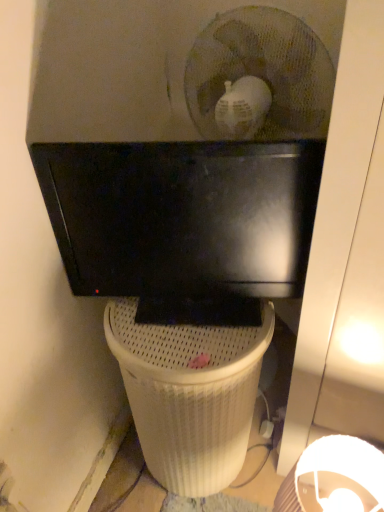
Question: Considering the positions of white mesh waste container at center and matte black monitor at upper center in the image, is white mesh waste container at center wider or thinner than matte black monitor at upper center?

Choices:
 (A) wide
 (B) thin

Answer: (A)

Question: From the image's perspective, is white mesh waste container at center located above or below matte black monitor at upper center?

Choices:
 (A) below
 (B) above

Answer: (A)

Question: In the image, is white mesh waste container at center positioned in front of or behind matte black monitor at upper center?

Choices:
 (A) behind
 (B) front

Answer: (A)

Question: Considering the positions of matte black monitor at upper center and white mesh waste container at center in the image, is matte black monitor at upper center taller or shorter than white mesh waste container at center?

Choices:
 (A) tall
 (B) short

Answer: (B)

Question: Looking at their shapes, would you say matte black monitor at upper center is wider or thinner than white mesh waste container at center?

Choices:
 (A) wide
 (B) thin

Answer: (B)

Question: From a real-world perspective, is matte black monitor at upper center positioned above or below white mesh waste container at center?

Choices:
 (A) below
 (B) above

Answer: (B)

Question: Relative to white mesh waste container at center, is matte black monitor at upper center in front or behind?

Choices:
 (A) front
 (B) behind

Answer: (A)